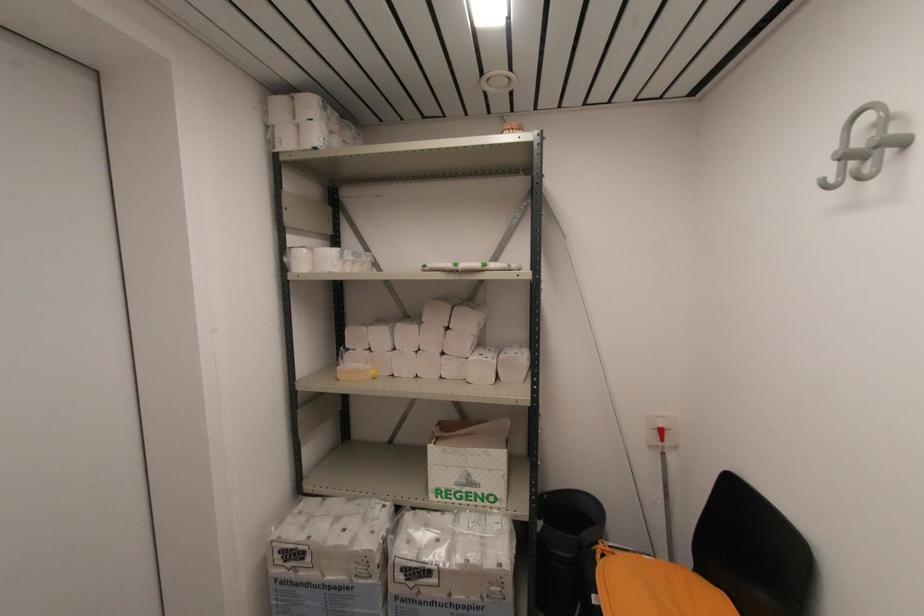
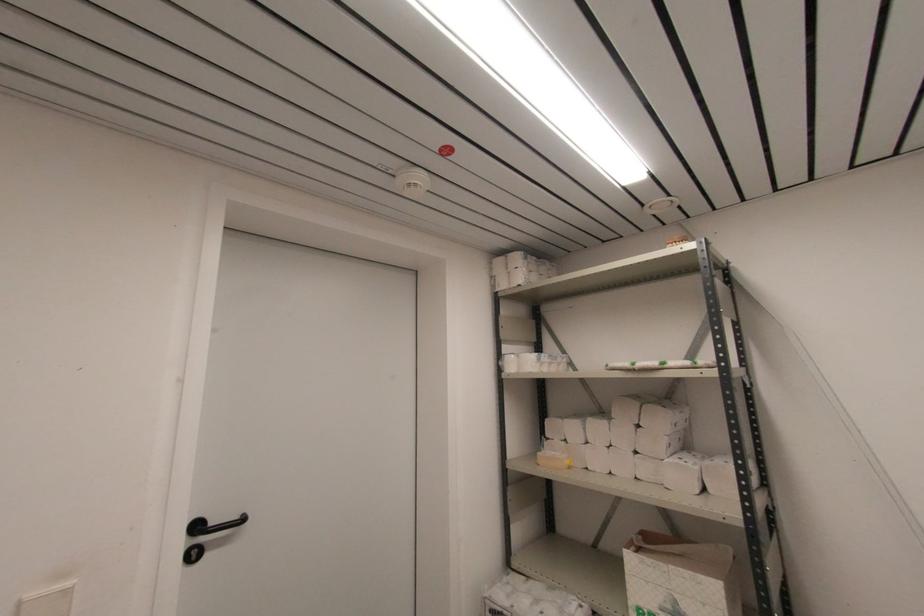
Find the pixel in the second image that matches the point at 371,329 in the first image.

(566, 421)